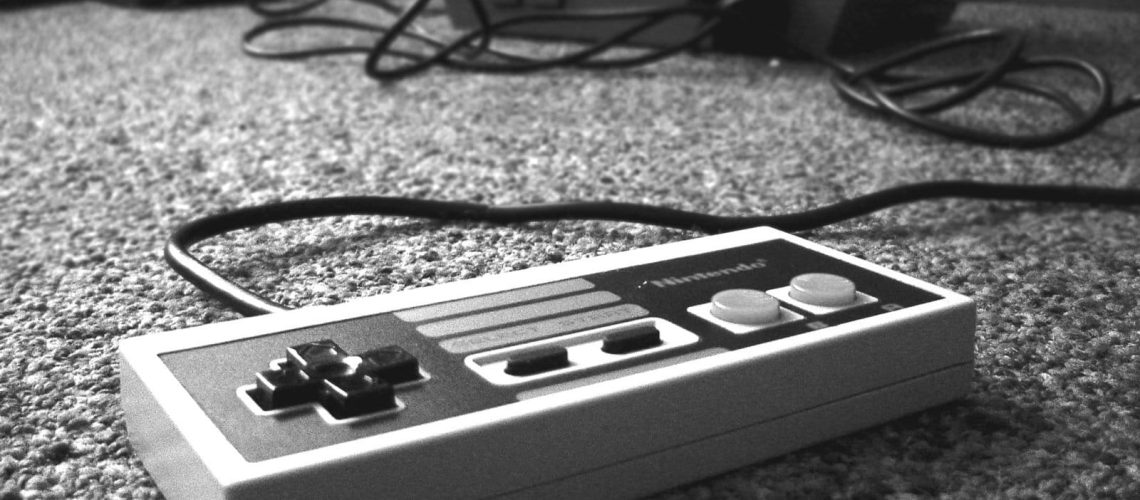
At what (x,y) coordinates should I click in order to perform the action: click on carpet. Please return your answer as a coordinate pair (x, y). The width and height of the screenshot is (1140, 500). Looking at the image, I should click on (156, 130), (1064, 365).